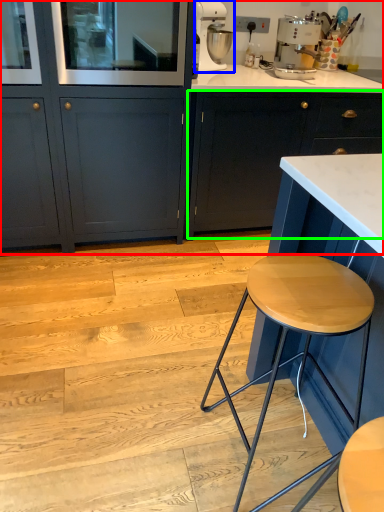
Question: Which object is the farthest from cabinetry (highlighted by a red box)? Choose among these: kitchen appliance (highlighted by a blue box) or cabinetry (highlighted by a green box).

Choices:
 (A) kitchen appliance
 (B) cabinetry

Answer: (A)